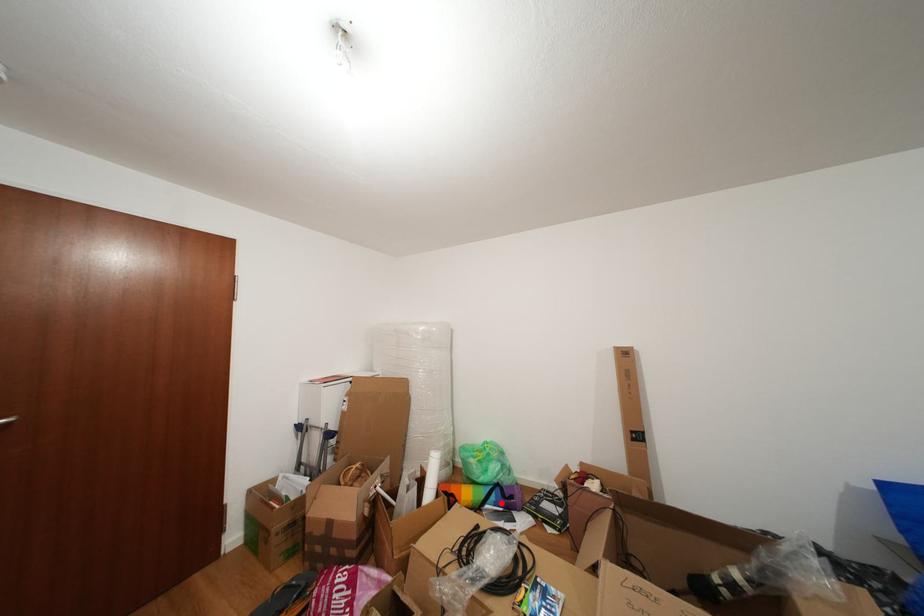
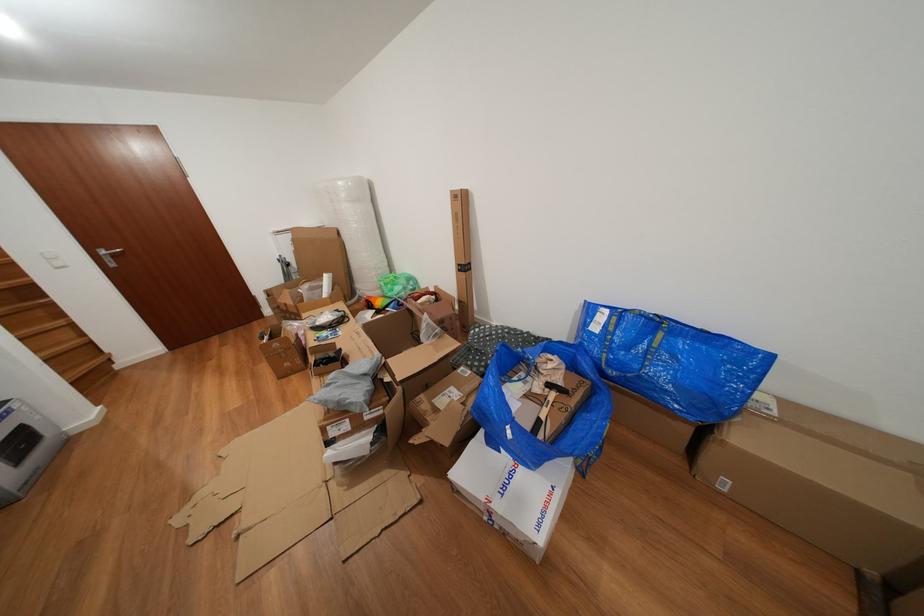
In the second image, find the point that corresponds to the highlighted location in the first image.

(399, 310)